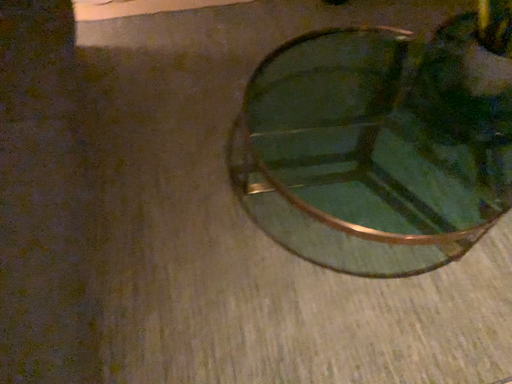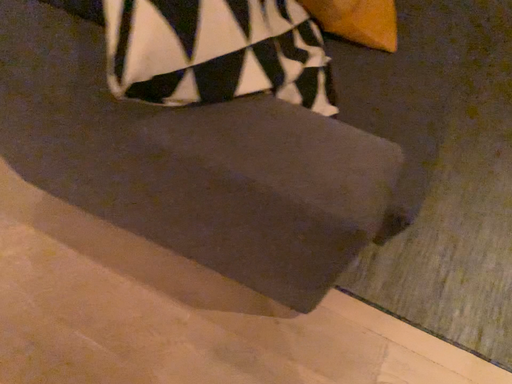
Question: How did the camera likely rotate when shooting the video?

Choices:
 (A) rotated left
 (B) rotated right

Answer: (A)